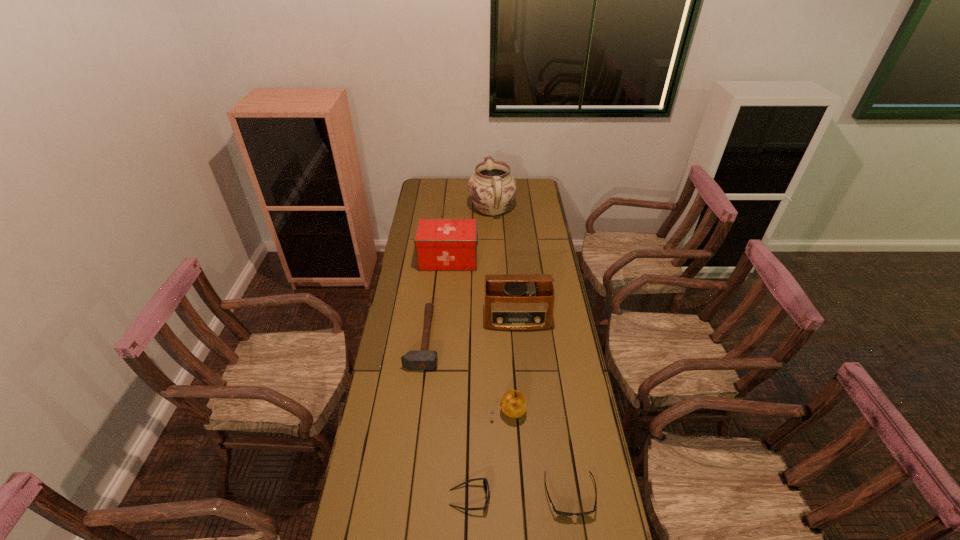
Identify the location of hammer positioned at the left edge. (413, 360).

I want to click on radio receiver located at the right edge, so click(514, 302).

Find the location of a particular element. sunglasses located in the right edge section of the desktop is located at coordinates (560, 513).

The width and height of the screenshot is (960, 540). Find the location of `blank space at the far edge of the desktop`. blank space at the far edge of the desktop is located at coordinates (459, 191).

You are a GUI agent. You are given a task and a screenshot of the screen. Output one action in this format:
    pyautogui.click(x=<x>, y=<y>)
    Task: Click on the vacant space at the left edge of the desktop
    
    Given the screenshot: What is the action you would take?
    pyautogui.click(x=416, y=201)

The height and width of the screenshot is (540, 960). In the image, there is a desktop. What are the coordinates of `vacant space at the right edge` in the screenshot? It's located at (550, 242).

You are a GUI agent. You are given a task and a screenshot of the screen. Output one action in this format:
    pyautogui.click(x=<x>, y=<y>)
    Task: Click on the free space at the far right corner of the desktop
    
    Given the screenshot: What is the action you would take?
    click(x=519, y=192)

Find the location of `empty space between the radio receiver and the third nearest object`. empty space between the radio receiver and the third nearest object is located at coordinates (513, 365).

Image resolution: width=960 pixels, height=540 pixels. What are the coordinates of `vacant point located between the shorter sunglasses and the sixth tallest object` in the screenshot? It's located at (520, 496).

This screenshot has width=960, height=540. What are the coordinates of `free spot between the radio receiver and the left sunglasses` in the screenshot? It's located at (493, 408).